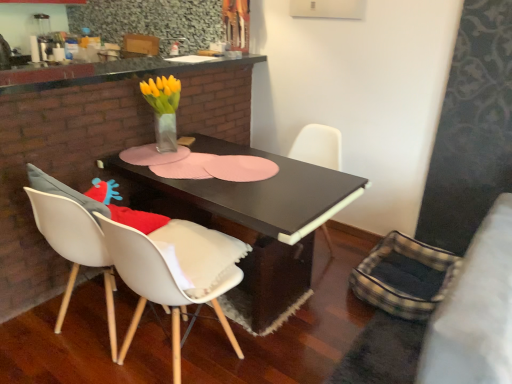
Question: Is black matte chair at center, acting as the 2th chair starting from the left, completely or partially outside of black matte table at center?

Choices:
 (A) yes
 (B) no

Answer: (A)

Question: Considering the relative sizes of black matte chair at center, the first chair when ordered from back to front, and black matte table at center in the image provided, is black matte chair at center, the first chair when ordered from back to front, shorter than black matte table at center?

Choices:
 (A) no
 (B) yes

Answer: (B)

Question: Is black matte chair at center, acting as the 1th chair starting from the right, facing towards black matte table at center?

Choices:
 (A) no
 (B) yes

Answer: (B)

Question: Considering the relative positions of black matte chair at center, acting as the 1th chair starting from the right, and black matte table at center in the image provided, is black matte chair at center, acting as the 1th chair starting from the right, behind black matte table at center?

Choices:
 (A) no
 (B) yes

Answer: (B)

Question: Does black matte chair at center, the 2th chair in the front-to-back sequence, lie in front of black matte table at center?

Choices:
 (A) no
 (B) yes

Answer: (A)

Question: Based on their sizes in the image, would you say granite countertop at upper center is bigger or smaller than white matte chair at lower left, the second chair viewed from the back?

Choices:
 (A) big
 (B) small

Answer: (B)

Question: Is granite countertop at upper center inside the boundaries of white matte chair at lower left, the second chair viewed from the back, or outside?

Choices:
 (A) inside
 (B) outside

Answer: (B)

Question: Considering the positions of granite countertop at upper center and white matte chair at lower left, the second chair viewed from the back, in the image, is granite countertop at upper center taller or shorter than white matte chair at lower left, the second chair viewed from the back,?

Choices:
 (A) short
 (B) tall

Answer: (A)

Question: In the image, is granite countertop at upper center positioned in front of or behind white matte chair at lower left, which appears as the 1th chair when viewed from the left?

Choices:
 (A) front
 (B) behind

Answer: (B)

Question: Is black matte chair at center, the 2th chair in the front-to-back sequence, taller or shorter than translucent glass vase at center?

Choices:
 (A) short
 (B) tall

Answer: (B)

Question: In terms of width, does black matte chair at center, acting as the 2th chair starting from the left, look wider or thinner when compared to translucent glass vase at center?

Choices:
 (A) thin
 (B) wide

Answer: (B)

Question: Would you say black matte chair at center, acting as the 1th chair starting from the right, is to the left or to the right of translucent glass vase at center in the picture?

Choices:
 (A) left
 (B) right

Answer: (B)

Question: Looking at the image, does black matte chair at center, the 2th chair in the front-to-back sequence, seem bigger or smaller compared to translucent glass vase at center?

Choices:
 (A) big
 (B) small

Answer: (A)

Question: In terms of height, does granite countertop at upper center look taller or shorter compared to translucent glass vase at center?

Choices:
 (A) tall
 (B) short

Answer: (B)

Question: Which is correct: granite countertop at upper center is inside translucent glass vase at center, or outside of it?

Choices:
 (A) outside
 (B) inside

Answer: (A)